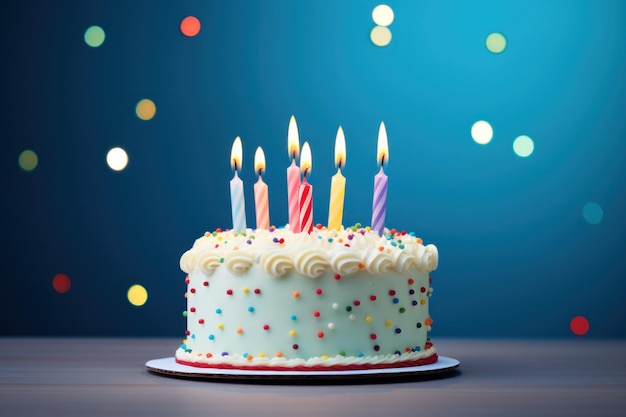
At what (x,y) coordinates should I click in order to perform the action: click on candle. Please return your answer as a coordinate pair (x, y). Image resolution: width=626 pixels, height=417 pixels. Looking at the image, I should click on (237, 198), (260, 197), (293, 185), (304, 204), (339, 207), (381, 203).